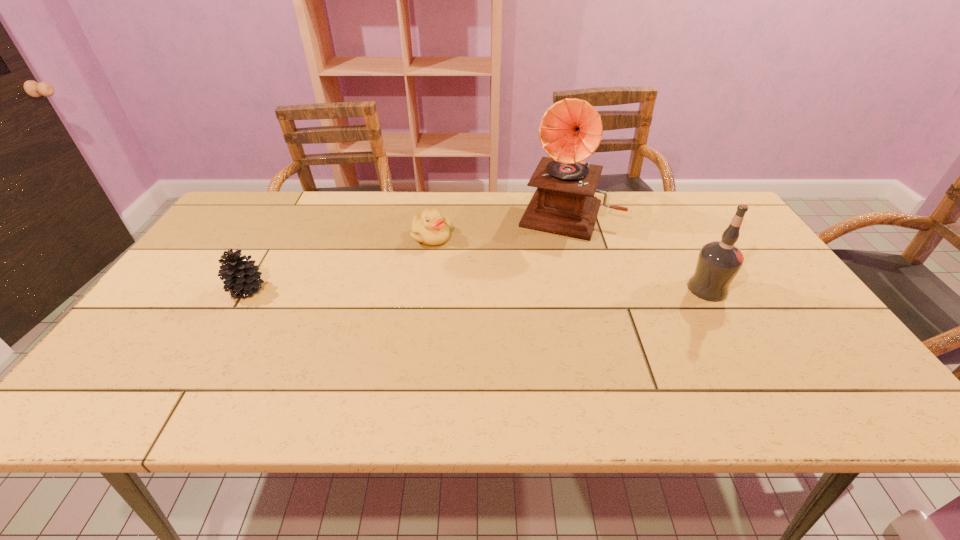
This screenshot has height=540, width=960. Identify the location of vacant space on the desktop that is between the leftmost object and the vodka and is positioned on the horn of the tallest object. (540, 289).

The height and width of the screenshot is (540, 960). I want to click on free spot on the desktop that is between the leftmost object and the rightmost object and is positioned on the beak of the third object from right to left, so click(444, 289).